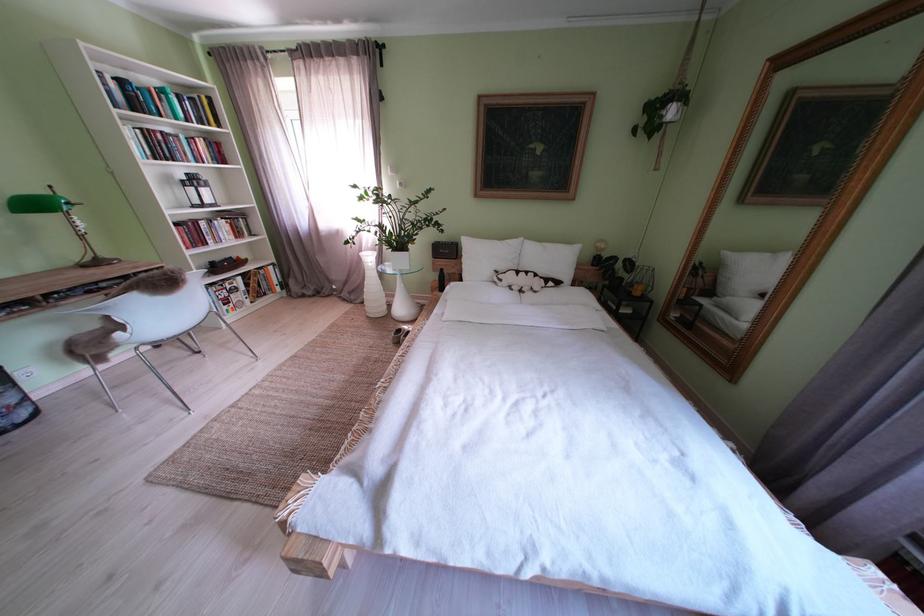
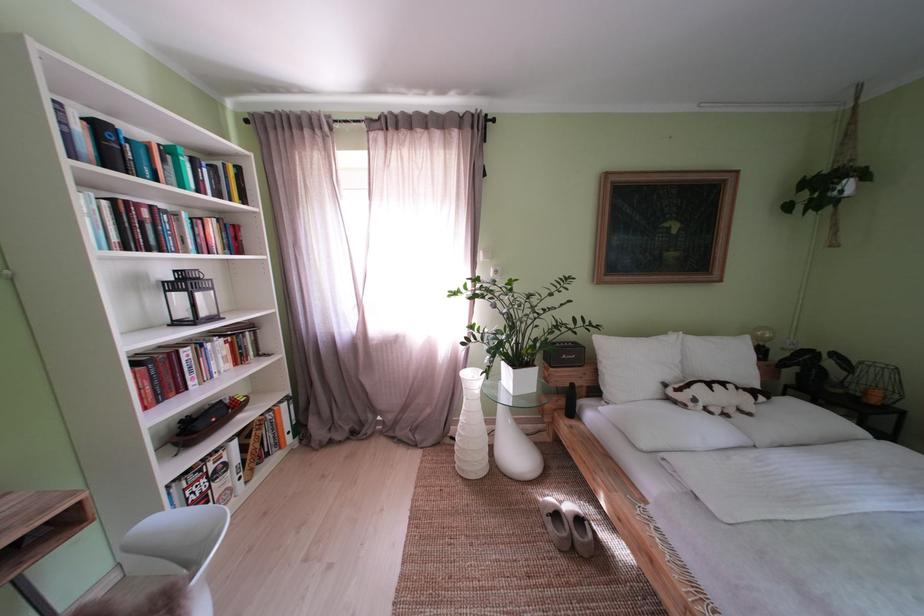
Where in the second image is the point corresponding to point 557,249 from the first image?

(723, 344)